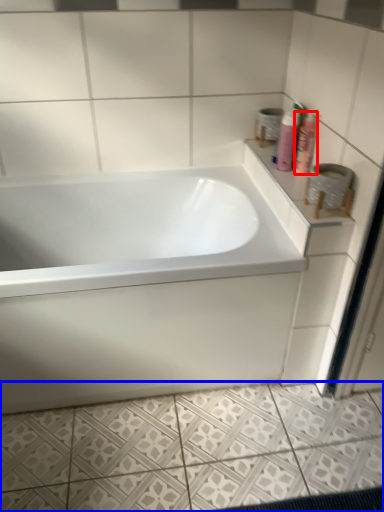
Question: Which object is further to the camera taking this photo, shaving cream (highlighted by a red box) or ceramic tile (highlighted by a blue box)?

Choices:
 (A) shaving cream
 (B) ceramic tile

Answer: (A)